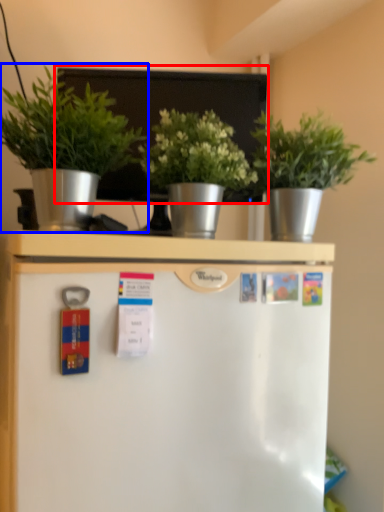
Question: Among these objects, which one is nearest to the camera, bulletin board (highlighted by a red box) or houseplant (highlighted by a blue box)?

Choices:
 (A) bulletin board
 (B) houseplant

Answer: (B)